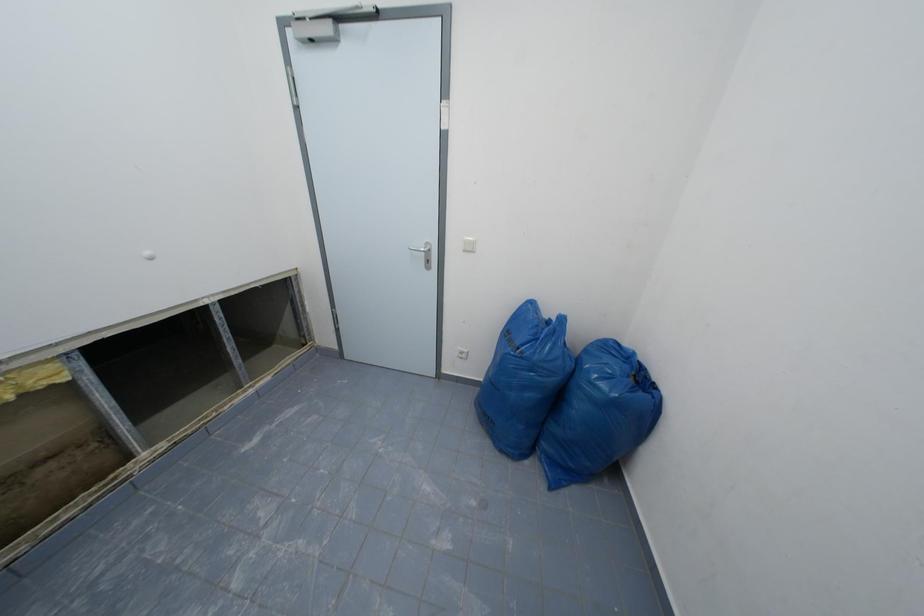
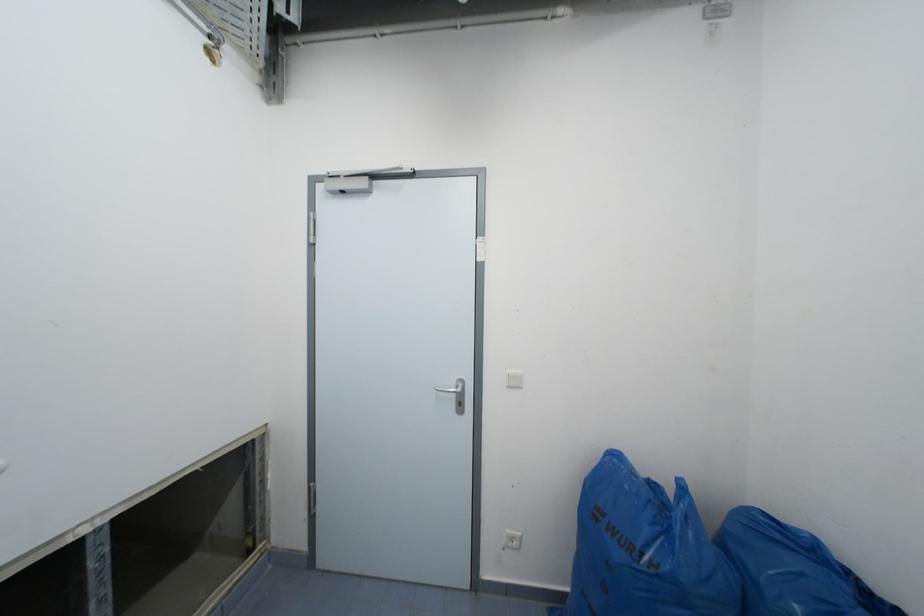
Question: The images are taken continuously from a first-person perspective. In which direction is your viewpoint rotating?

Choices:
 (A) Left
 (B) Right
 (C) Up
 (D) Down

Answer: (C)